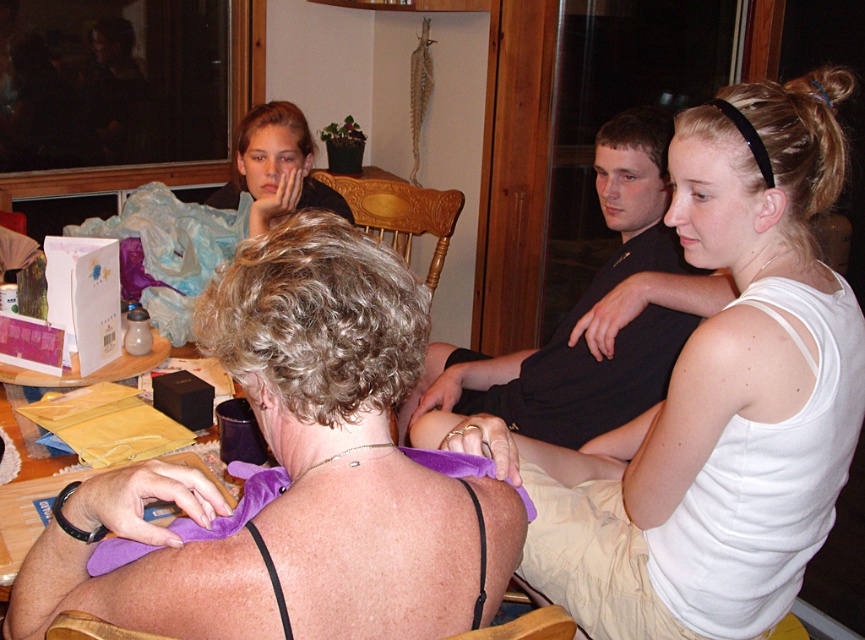
Who is shorter, white cotton tank top at upper right or purple fabric at upper center?

purple fabric at upper center is shorter.

Between point (825, 189) and point (388, 298), which one is positioned in front?

Point (388, 298) is in front.

This screenshot has width=865, height=640. Find the location of `white cotton tank top at upper right`. white cotton tank top at upper right is located at coordinates (721, 396).

Between purple fabric at upper center and wooden table at center, which one has less height?

Standing shorter between the two is wooden table at center.

Between purple fabric at upper center and wooden table at center, which one is positioned lower?

purple fabric at upper center

The width and height of the screenshot is (865, 640). I want to click on purple fabric at upper center, so click(298, 474).

Where is `purple fabric at upper center`? The height and width of the screenshot is (640, 865). purple fabric at upper center is located at coordinates (298, 474).

Between white cotton tank top at upper right and wooden table at center, which one appears on the right side from the viewer's perspective?

white cotton tank top at upper right

Does white cotton tank top at upper right have a larger size compared to wooden table at center?

Correct, white cotton tank top at upper right is larger in size than wooden table at center.

At what (x,y) coordinates should I click in order to perform the action: click on white cotton tank top at upper right. Please return your answer as a coordinate pair (x, y). Looking at the image, I should click on (721, 396).